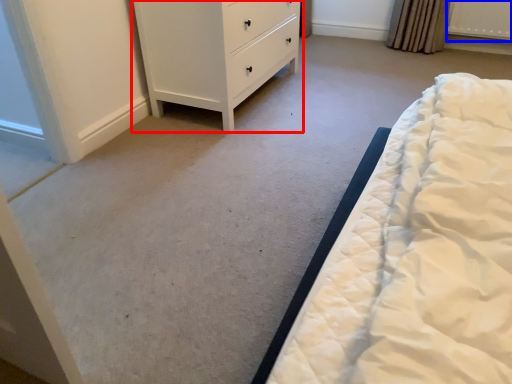
Question: Among these objects, which one is farthest to the camera, chest of drawers (highlighted by a red box) or radiator (highlighted by a blue box)?

Choices:
 (A) chest of drawers
 (B) radiator

Answer: (B)